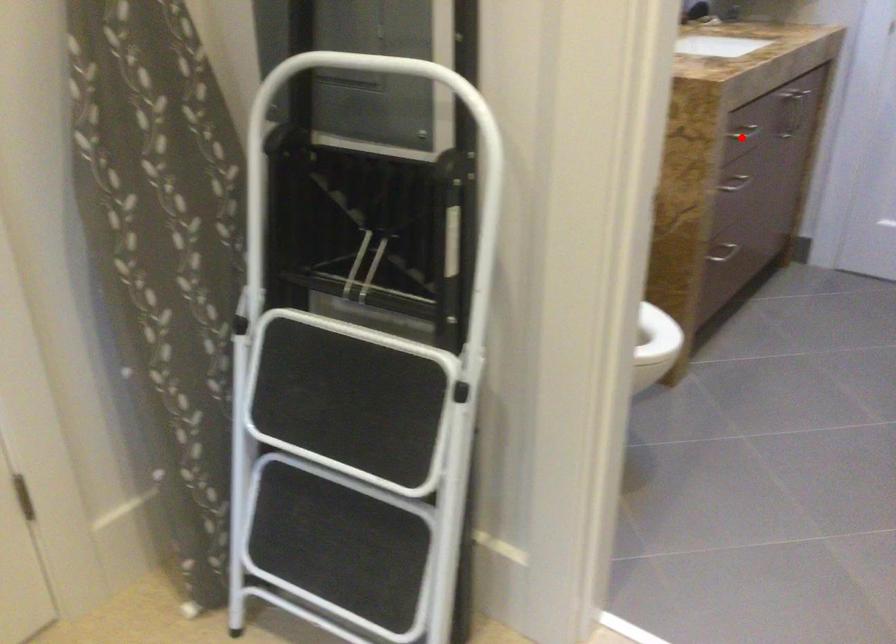
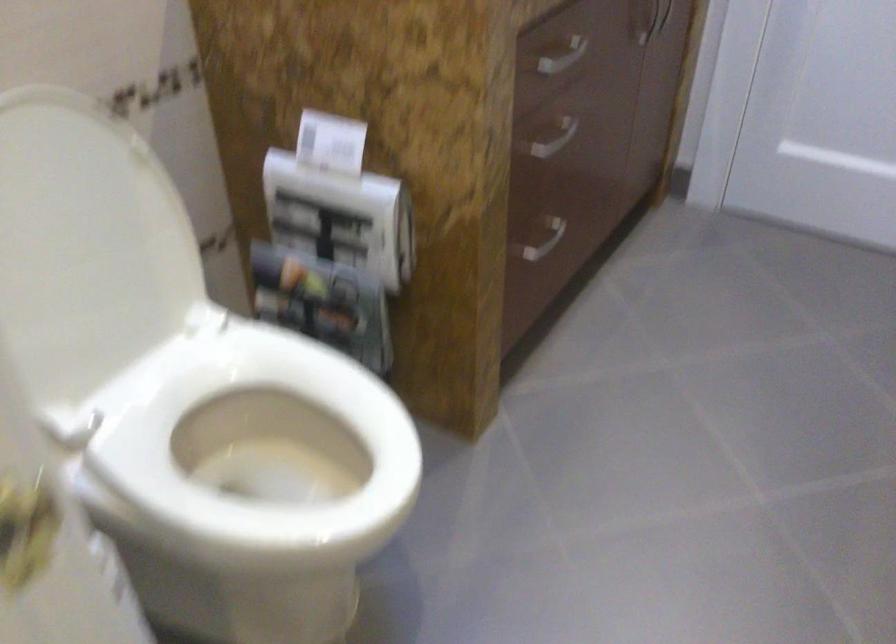
Question: I am providing you with two images of the same scene from different viewpoints. Image1 has a red point marked. In image2, the corresponding 3D location appears at what relative position? Reply with the corresponding letter.

Choices:
 (A) Closer
 (B) Farther

Answer: (A)